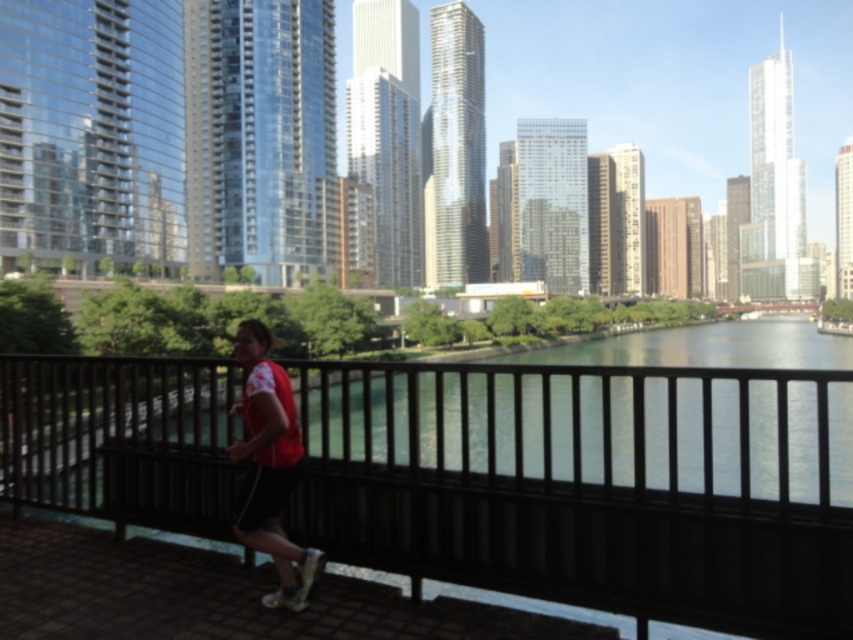
You are a photographer trying to capture the city skyline through the black wood railing at center while the jogger in the red matte shirt at center is moving. Will the railing block your view of the shirt?

The black wood railing at center is in front of the red matte shirt at center, so the railing will block the view of the shirt.

You are a photographer trying to capture the city skyline through the space between the black wood railing at center and the red matte shirt at center. Can you fit the entire skyline into your shot without any obstruction?

The black wood railing at center is taller than the red matte shirt at center, so the space between them may not be wide enough to fully capture the entire skyline without obstruction.

You are standing on the bridge and want to take a photo of the city skyline. The black wood railing at center is in your way. Can you move to the left or right to avoid it?

Since the black wood railing at center is located at point (590, 484), you can move either to the left or right to avoid it and get a clear view of the city skyline.